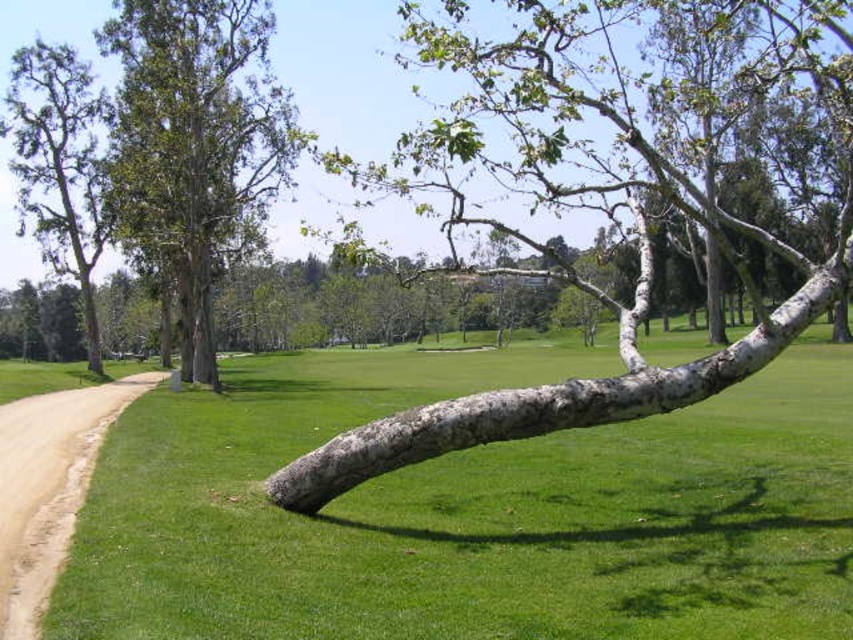
You are planning to plant a new tree in this area and need to ensure there is enough space between the existing trees. The recommended minimum distance between trees is 30 feet. Based on the image, will the green leafy tree at upper left and the smooth gray bark tree at left meet this requirement?

The green leafy tree at upper left and the smooth gray bark tree at left are 36.94 feet apart from each other, which exceeds the recommended minimum distance of 30 feet. Therefore, they meet the spacing requirement.

You are standing on the dirt path at the left side of the image and want to take a photo of both the green leafy tree at upper left and the smooth gray bark tree at left. Which tree should you point your camera upwards to capture?

You should point your camera upwards to capture the green leafy tree at upper left because it is located above the smooth gray bark tree at left.

You are a golfer standing on the green grass at center and want to hit a ball towards the smooth gray bark tree at left. Considering their sizes, which object would require a larger force to move if you were to displace them both?

The smooth gray bark tree at left would require a larger force to move because it is bigger than the green grass at center.